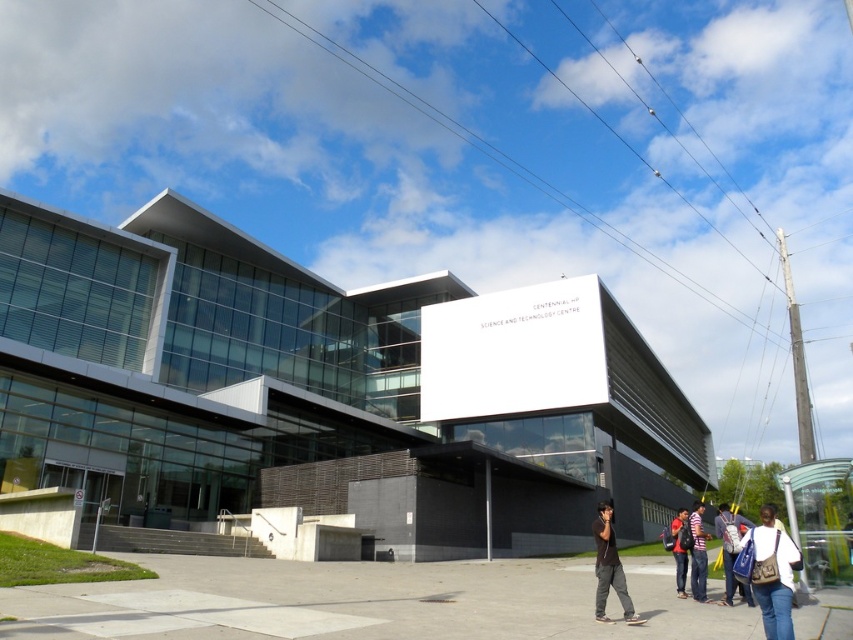
Question: Does gray concrete pavement at lower center have a larger size compared to blue fabric bag at lower right?

Choices:
 (A) no
 (B) yes

Answer: (A)

Question: Which object appears farthest from the camera in this image?

Choices:
 (A) white matte sign at center
 (B) dark brown shirt at center

Answer: (A)

Question: Which object is closer to the camera taking this photo?

Choices:
 (A) denim jacket at lower right
 (B) gray concrete pavement at lower center
 (C) striped shirt at center

Answer: (B)

Question: Is dark brown shirt at center positioned at the back of striped shirt at center?

Choices:
 (A) no
 (B) yes

Answer: (A)

Question: Which of the following is the closest to the observer?

Choices:
 (A) denim jacket at lower right
 (B) striped shirt at center
 (C) glassy modern building at center
 (D) gray concrete pavement at lower center

Answer: (D)

Question: Is gray concrete pavement at lower center below dark brown shirt at center?

Choices:
 (A) no
 (B) yes

Answer: (A)